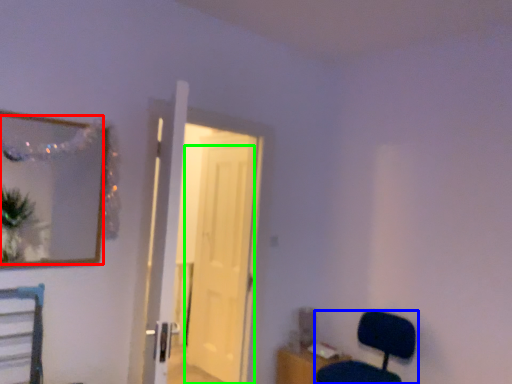
Question: Based on their relative distances, which object is nearer to mirror (highlighted by a red box)? Choose from chair (highlighted by a blue box) and door (highlighted by a green box).

Choices:
 (A) chair
 (B) door

Answer: (B)